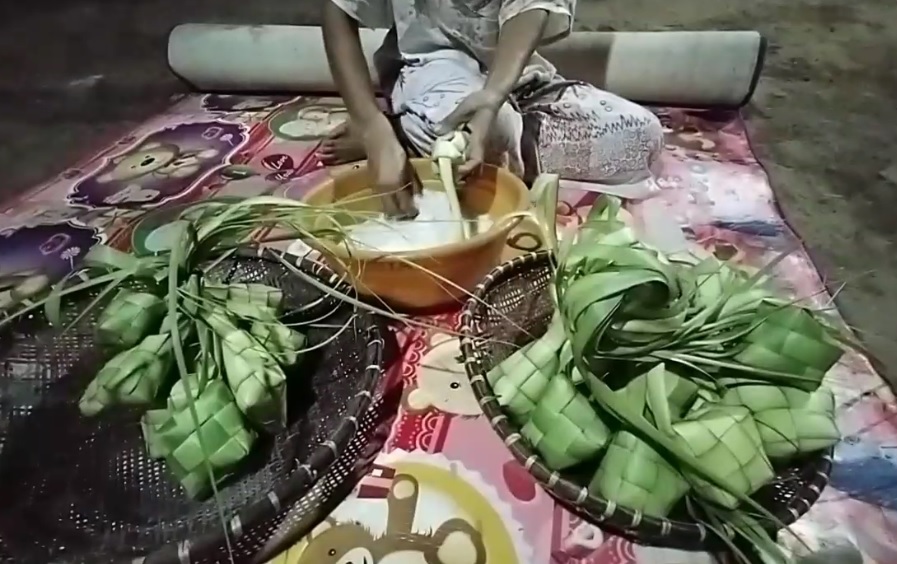
The width and height of the screenshot is (897, 564). I want to click on unrolled portion of rug, so click(x=716, y=74).